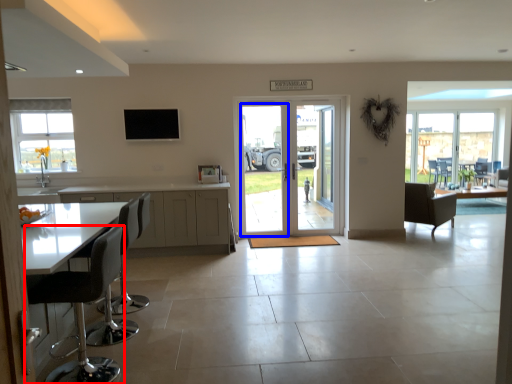
Question: Which of the following is the farthest to the observer, chair (highlighted by a red box) or screen door (highlighted by a blue box)?

Choices:
 (A) chair
 (B) screen door

Answer: (B)